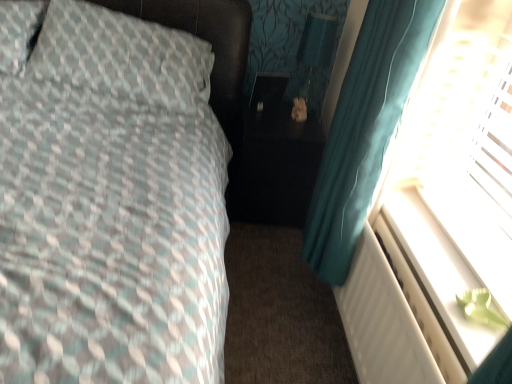
Question: From a real-world perspective, is matte black table lamp at center positioned under black glossy side table at center based on gravity?

Choices:
 (A) yes
 (B) no

Answer: (B)

Question: Is matte black table lamp at center not inside black glossy side table at center?

Choices:
 (A) no
 (B) yes

Answer: (B)

Question: Considering the relative sizes of matte black table lamp at center and black glossy side table at center in the image provided, is matte black table lamp at center wider than black glossy side table at center?

Choices:
 (A) no
 (B) yes

Answer: (A)

Question: From the image's perspective, is matte black table lamp at center on top of black glossy side table at center?

Choices:
 (A) yes
 (B) no

Answer: (A)

Question: Does matte black table lamp at center turn towards black glossy side table at center?

Choices:
 (A) yes
 (B) no

Answer: (B)

Question: From a real-world perspective, is matte black table lamp at center physically located above or below white plastic radiator at lower right?

Choices:
 (A) above
 (B) below

Answer: (A)

Question: Do you think matte black table lamp at center is within white plastic radiator at lower right, or outside of it?

Choices:
 (A) outside
 (B) inside

Answer: (A)

Question: Looking at their shapes, would you say matte black table lamp at center is wider or thinner than white plastic radiator at lower right?

Choices:
 (A) wide
 (B) thin

Answer: (A)

Question: Considering their positions, is matte black table lamp at center located in front of or behind white plastic radiator at lower right?

Choices:
 (A) front
 (B) behind

Answer: (B)

Question: Which is correct: white plastic radiator at lower right is inside black glossy side table at center, or outside of it?

Choices:
 (A) outside
 (B) inside

Answer: (A)

Question: Is white plastic radiator at lower right wider or thinner than black glossy side table at center?

Choices:
 (A) thin
 (B) wide

Answer: (A)

Question: Considering their positions, is white plastic radiator at lower right located in front of or behind black glossy side table at center?

Choices:
 (A) behind
 (B) front

Answer: (B)

Question: From the image's perspective, is white plastic radiator at lower right positioned above or below black glossy side table at center?

Choices:
 (A) below
 (B) above

Answer: (A)

Question: In terms of size, does white plastic radiator at lower right appear bigger or smaller than transparent plastic screen at right?

Choices:
 (A) small
 (B) big

Answer: (A)

Question: Considering the positions of point (352, 258) and point (464, 331), is point (352, 258) closer or farther from the camera than point (464, 331)?

Choices:
 (A) closer
 (B) farther

Answer: (B)